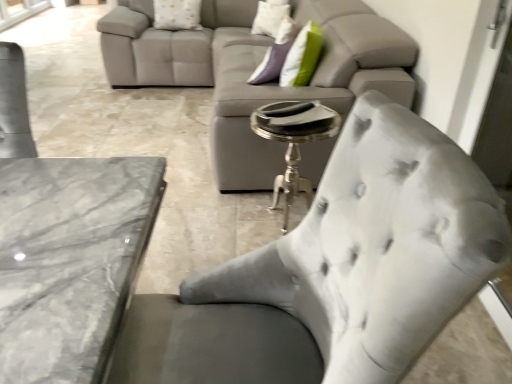
Question: Is white textured pillow at upper center, the 2th pillow in the right-to-left sequence, inside satin gray chair at lower right?

Choices:
 (A) yes
 (B) no

Answer: (B)

Question: Does satin gray chair at lower right lie in front of white textured pillow at upper center, the first pillow from the left?

Choices:
 (A) yes
 (B) no

Answer: (A)

Question: From a real-world perspective, is satin gray chair at lower right below white textured pillow at upper center, the 2th pillow in the right-to-left sequence?

Choices:
 (A) yes
 (B) no

Answer: (A)

Question: Considering the relative sizes of satin gray chair at lower right and white textured pillow at upper center, the first pillow from the left, in the image provided, is satin gray chair at lower right smaller than white textured pillow at upper center, the first pillow from the left,?

Choices:
 (A) yes
 (B) no

Answer: (B)

Question: Is satin gray chair at lower right not near white textured pillow at upper center, the first pillow from the left?

Choices:
 (A) yes
 (B) no

Answer: (A)

Question: Is satin gray chair at lower right outside of white textured pillow at upper center, the 2th pillow in the right-to-left sequence?

Choices:
 (A) no
 (B) yes

Answer: (B)

Question: Does white textured pillow at upper center, the second pillow when ordered from left to right, contain silver metallic side table at center?

Choices:
 (A) yes
 (B) no

Answer: (B)

Question: From a real-world perspective, is white textured pillow at upper center, the second pillow when ordered from left to right, physically below silver metallic side table at center?

Choices:
 (A) yes
 (B) no

Answer: (B)

Question: From the image's perspective, is white textured pillow at upper center, the second pillow when ordered from left to right, beneath silver metallic side table at center?

Choices:
 (A) no
 (B) yes

Answer: (A)

Question: Does white textured pillow at upper center, the second pillow when ordered from left to right, have a greater height compared to silver metallic side table at center?

Choices:
 (A) yes
 (B) no

Answer: (B)

Question: Is the depth of white textured pillow at upper center, the second pillow when ordered from left to right, greater than that of silver metallic side table at center?

Choices:
 (A) no
 (B) yes

Answer: (B)

Question: Does white textured pillow at upper center, arranged as the 1th pillow when viewed from the right, turn towards silver metallic side table at center?

Choices:
 (A) no
 (B) yes

Answer: (A)

Question: Considering the relative positions of satin gray chair at lower right and white textured pillow at upper center, the second pillow when ordered from left to right, in the image provided, is satin gray chair at lower right to the left of white textured pillow at upper center, the second pillow when ordered from left to right, from the viewer's perspective?

Choices:
 (A) no
 (B) yes

Answer: (B)